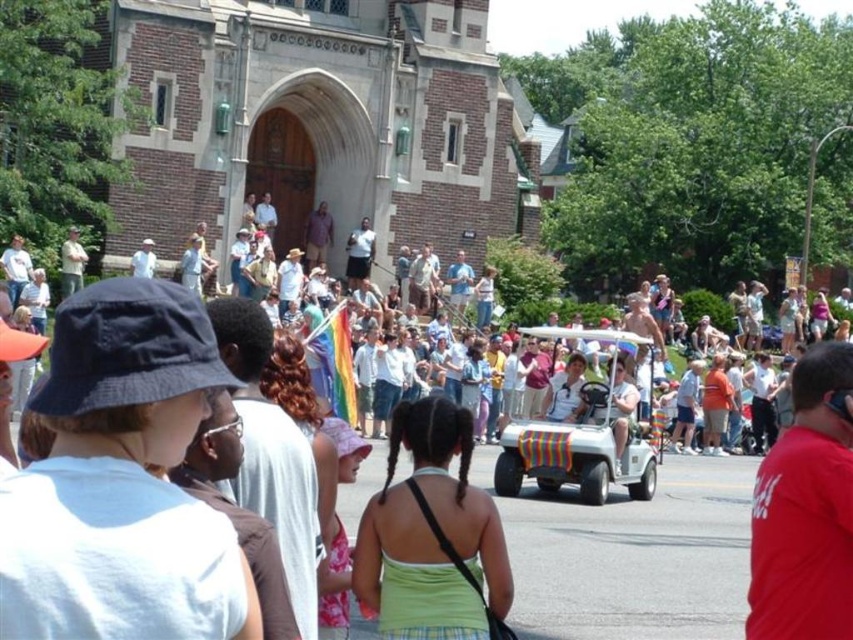
Question: Is white cotton shirt at center below white plastic golf cart at center?

Choices:
 (A) yes
 (B) no

Answer: (B)

Question: Considering the real-world distances, which object is closest to the red cotton shirt at right?

Choices:
 (A) white cotton shirt at center
 (B) white plastic golf cart at center
 (C) rainbow striped cart at center
 (D) green fabric dress at center

Answer: (C)

Question: Which object is the closest to the white plastic golf cart at center?

Choices:
 (A) rainbow striped cart at center
 (B) green fabric dress at center
 (C) red cotton shirt at right

Answer: (A)

Question: Which object is the closest to the rainbow striped cart at center?

Choices:
 (A) white cotton shirt at center
 (B) white plastic golf cart at center
 (C) green fabric dress at center

Answer: (B)

Question: Can you confirm if rainbow striped cart at center is positioned above green fabric dress at center?

Choices:
 (A) yes
 (B) no

Answer: (A)

Question: Can you confirm if white cotton shirt at center is positioned to the right of green fabric dress at center?

Choices:
 (A) no
 (B) yes

Answer: (A)